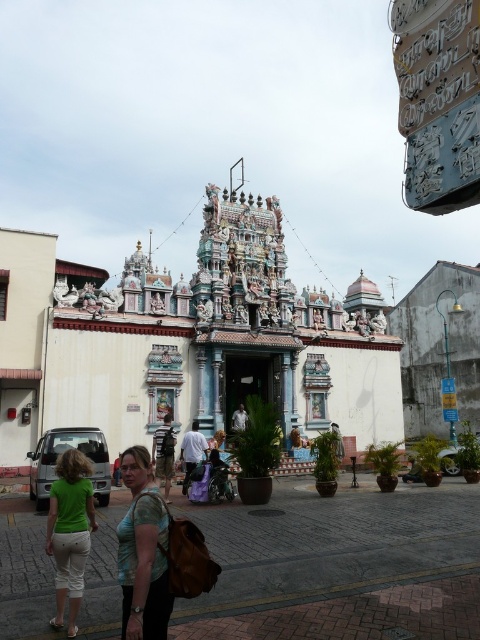
You are standing in front of the temple and want to take a photo of the point at coordinates (351,408). If the camera you are using has a maximum focus range of 85 meters, will the point be in focus?

The point at coordinates (351,408) is 86.09 meters away from the camera, which exceeds the maximum focus range of 85 meters. Therefore, the point will not be in focus.

You are standing at the entrance of the temple and want to greet the person wearing the green fabric shirt at center. In which direction should you walk to reach them?

The green fabric shirt at center is located at point 0.864 on the x axis and 0.298 on the y axis, so you should walk towards the center of the temple area to reach them.